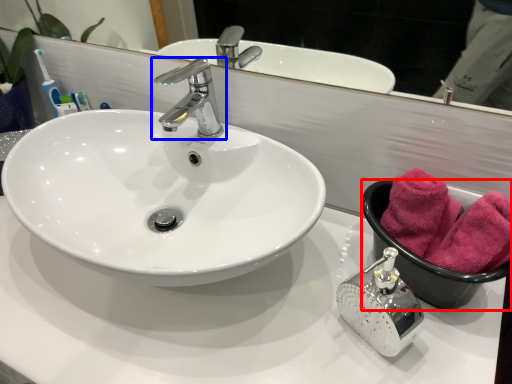
Question: Which object is closer to the camera taking this photo, basin (highlighted by a red box) or tap (highlighted by a blue box)?

Choices:
 (A) basin
 (B) tap

Answer: (A)